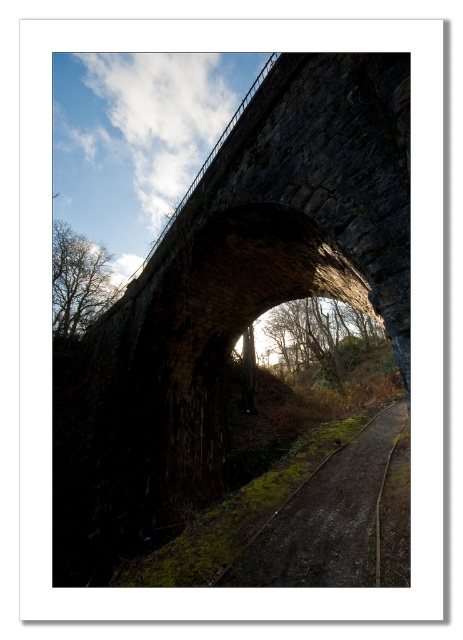
Is dark stone bridge at center closer to the viewer compared to brown dirt track at center?

Yes.

Between dark stone bridge at center and brown dirt track at center, which one appears on the right side from the viewer's perspective?

brown dirt track at center is more to the right.

Is point (150, 529) behind point (382, 420)?

No, it is in front of (382, 420).

This screenshot has width=463, height=640. I want to click on dark stone bridge at center, so click(230, 300).